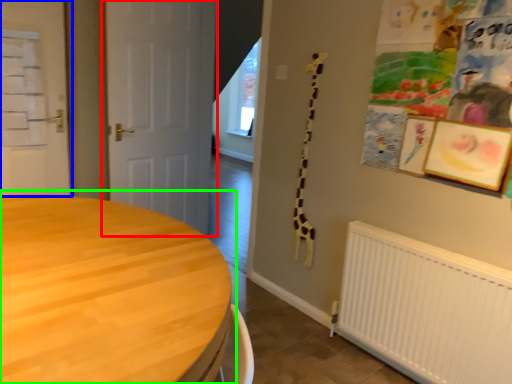
Question: Which object is positioned closest to door (highlighted by a red box)? Select from door (highlighted by a blue box) and table (highlighted by a green box).

Choices:
 (A) door
 (B) table

Answer: (A)